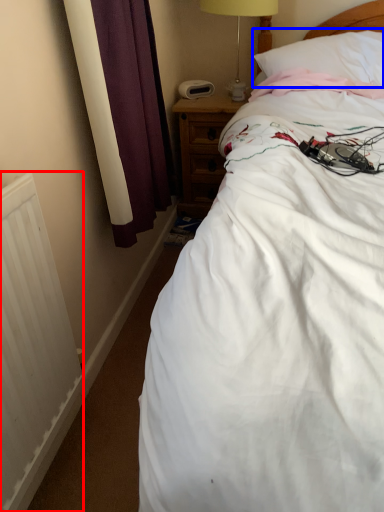
Question: Which of the following is the farthest to the observer, radiator (highlighted by a red box) or pillow (highlighted by a blue box)?

Choices:
 (A) radiator
 (B) pillow

Answer: (B)